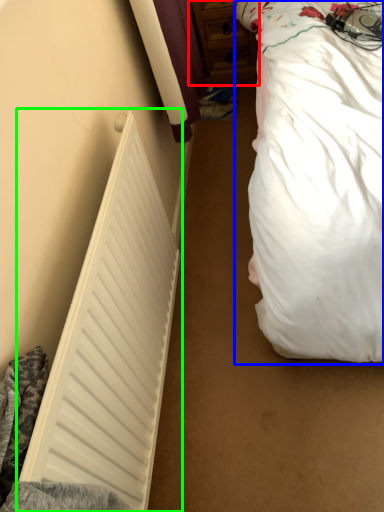
Question: Which object is the farthest from dresser (highlighted by a red box)? Choose among these: bed (highlighted by a blue box) or radiator (highlighted by a green box).

Choices:
 (A) bed
 (B) radiator

Answer: (B)